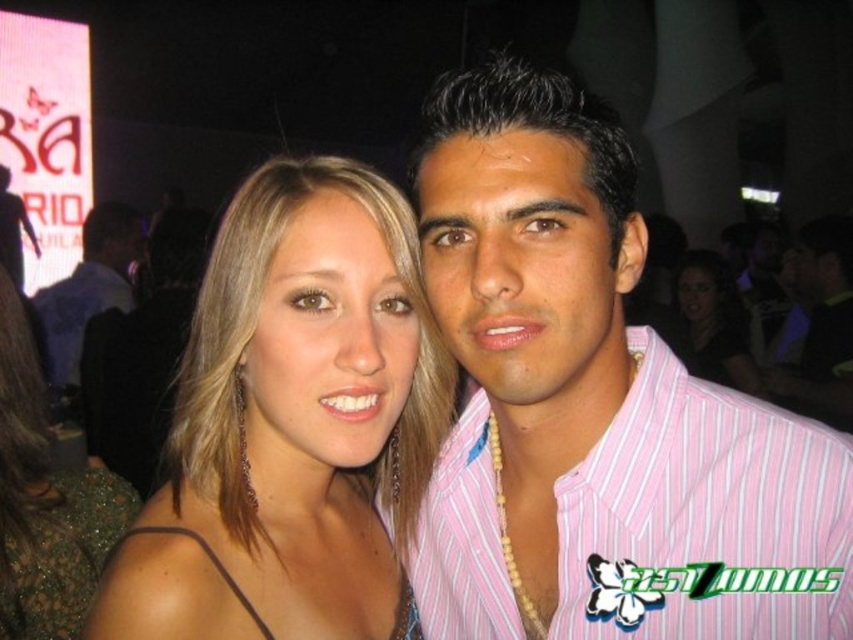
In the scene shown: Does pink striped shirt at center have a lesser height compared to green sequined dress at lower left?

Yes, pink striped shirt at center is shorter than green sequined dress at lower left.

Does pink striped shirt at center have a lesser width compared to green sequined dress at lower left?

Incorrect, pink striped shirt at center's width is not less than green sequined dress at lower left's.

Which is behind, point (549, 189) or point (33, 586)?

Point (33, 586)

Identify the location of pink striped shirt at center. (596, 410).

Can you confirm if pink striped shirt at center is thinner than matte black hair at center?

Indeed, pink striped shirt at center has a lesser width compared to matte black hair at center.

Does pink striped shirt at center lie in front of matte black hair at center?

That is True.

Is point (640, 234) positioned before point (729, 300)?

Yes, point (640, 234) is in front of point (729, 300).

What are the coordinates of `pink striped shirt at center` in the screenshot? It's located at (596, 410).

Locate an element on the screen. Image resolution: width=853 pixels, height=640 pixels. shiny gold earrings at center is located at coordinates (292, 422).

Is shiny gold earrings at center in front of green sequined dress at lower left?

That is True.

Identify the location of shiny gold earrings at center. The image size is (853, 640). (292, 422).